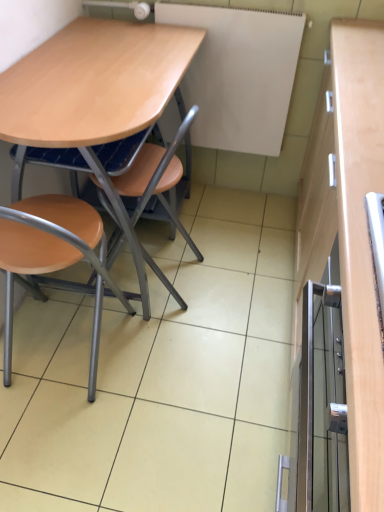
Question: Can we say metallic silver cabinet at right lies outside matte wood chair at lower left, marked as the first chair in a left-to-right arrangement?

Choices:
 (A) yes
 (B) no

Answer: (A)

Question: From a real-world perspective, is metallic silver cabinet at right positioned over matte wood chair at lower left, which ranks as the second chair in right-to-left order, based on gravity?

Choices:
 (A) no
 (B) yes

Answer: (B)

Question: Is metallic silver cabinet at right to the left of matte wood chair at lower left, marked as the first chair in a left-to-right arrangement, from the viewer's perspective?

Choices:
 (A) no
 (B) yes

Answer: (A)

Question: Is metallic silver cabinet at right positioned in front of matte wood chair at lower left, marked as the first chair in a left-to-right arrangement?

Choices:
 (A) yes
 (B) no

Answer: (A)

Question: Can you confirm if metallic silver cabinet at right is taller than matte wood chair at lower left, marked as the first chair in a left-to-right arrangement?

Choices:
 (A) yes
 (B) no

Answer: (B)

Question: Is light brown wood desk at center wider or thinner than white matte board at upper center?

Choices:
 (A) wide
 (B) thin

Answer: (A)

Question: Which is correct: light brown wood desk at center is inside white matte board at upper center, or outside of it?

Choices:
 (A) inside
 (B) outside

Answer: (B)

Question: Based on their positions, is light brown wood desk at center located to the left or right of white matte board at upper center?

Choices:
 (A) left
 (B) right

Answer: (A)

Question: From the image's perspective, is light brown wood desk at center positioned above or below white matte board at upper center?

Choices:
 (A) below
 (B) above

Answer: (A)

Question: Relative to matte wood chair at center, which appears as the 2th chair when viewed from the left, is metallic silver cabinet at right in front or behind?

Choices:
 (A) behind
 (B) front

Answer: (B)

Question: From the image's perspective, is metallic silver cabinet at right positioned above or below matte wood chair at center, which is counted as the first chair, starting from the right?

Choices:
 (A) above
 (B) below

Answer: (B)

Question: Is metallic silver cabinet at right situated inside matte wood chair at center, which appears as the 2th chair when viewed from the left, or outside?

Choices:
 (A) inside
 (B) outside

Answer: (B)

Question: In terms of height, does metallic silver cabinet at right look taller or shorter compared to matte wood chair at center, which is counted as the first chair, starting from the right?

Choices:
 (A) short
 (B) tall

Answer: (A)

Question: Looking at their shapes, would you say white matte board at upper center is wider or thinner than light brown wood desk at center?

Choices:
 (A) wide
 (B) thin

Answer: (B)

Question: From the image's perspective, is white matte board at upper center located above or below light brown wood desk at center?

Choices:
 (A) above
 (B) below

Answer: (A)